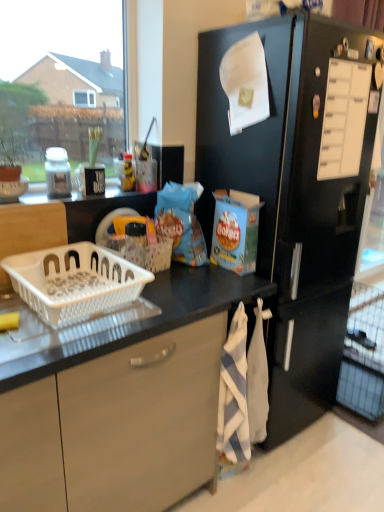
Image resolution: width=384 pixels, height=512 pixels. What are the coordinates of `blank space situated above white plastic basket at center, which is counted as the 1th basket, starting from the back (from a real-world perspective)` in the screenshot? It's located at (134, 243).